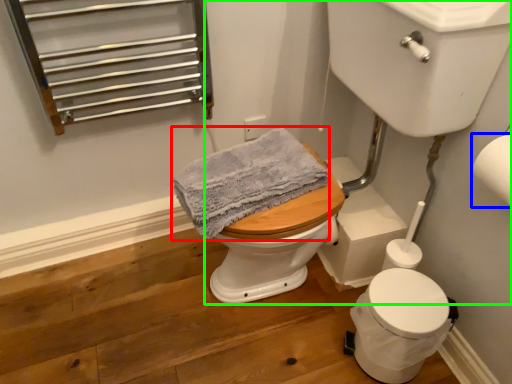
Question: Considering the real-world distances, which object is closest to bath towel (highlighted by a red box)? toilet paper (highlighted by a blue box) or sink (highlighted by a green box).

Choices:
 (A) toilet paper
 (B) sink

Answer: (B)